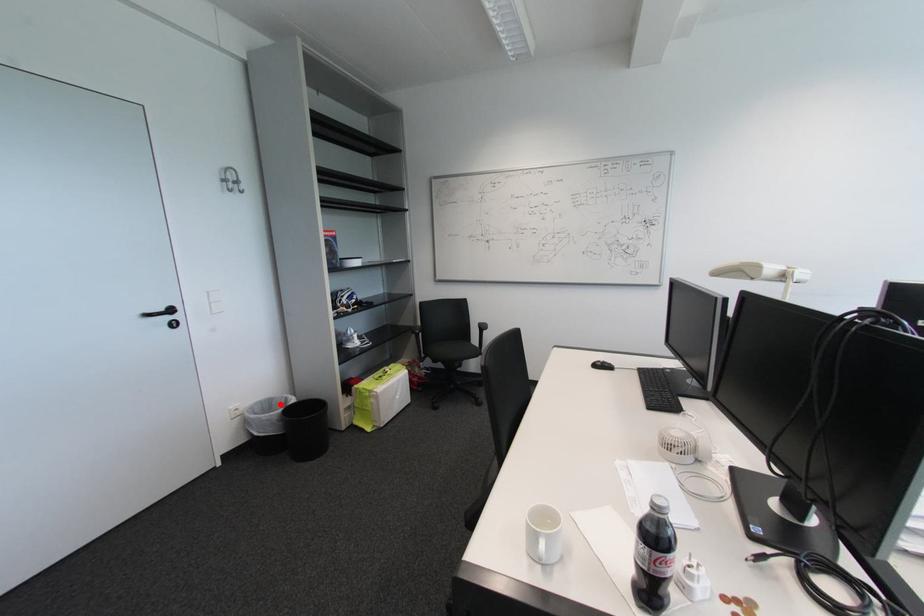
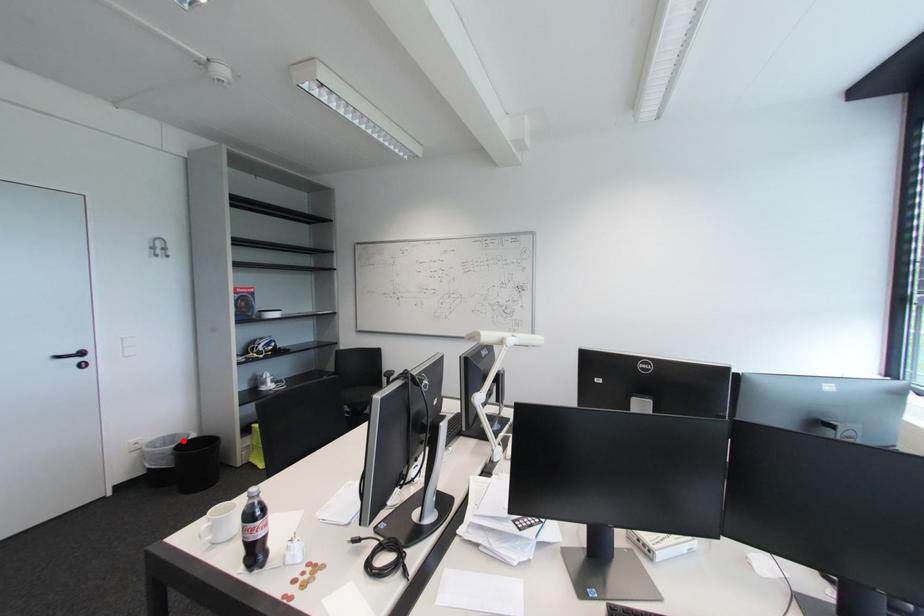
I am providing you with two images of the same scene from different viewpoints. A red point is marked on the first image and another point is marked on the second image. Is the marked point in image1 the same physical position as the marked point in image2?

Yes